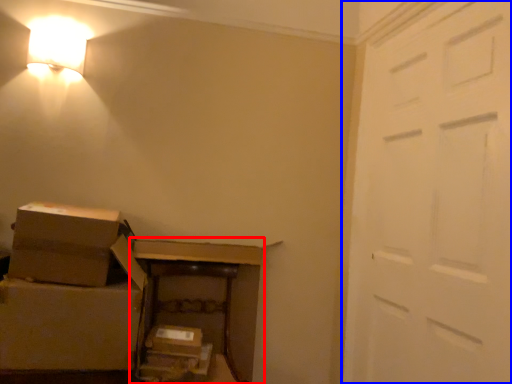
Question: Which of the following is the closest to the observer, furniture (highlighted by a red box) or door (highlighted by a blue box)?

Choices:
 (A) furniture
 (B) door

Answer: (B)